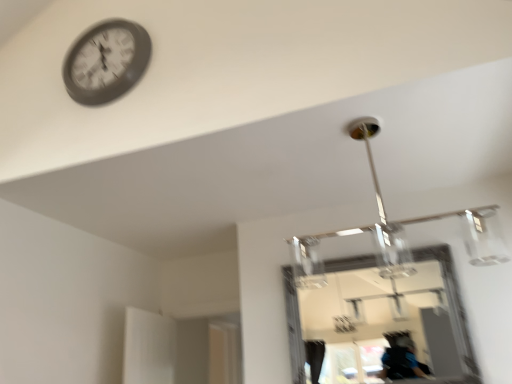
Question: From a real-world perspective, is matte black clock at upper left above or below clear glass mirror at center?

Choices:
 (A) below
 (B) above

Answer: (B)

Question: Considering the positions of point (128, 26) and point (433, 251), is point (128, 26) closer or farther from the camera than point (433, 251)?

Choices:
 (A) closer
 (B) farther

Answer: (A)

Question: Do you think matte black clock at upper left is within clear glass mirror at center, or outside of it?

Choices:
 (A) outside
 (B) inside

Answer: (A)

Question: Visually, is clear glass mirror at center positioned to the left or to the right of matte black clock at upper left?

Choices:
 (A) right
 (B) left

Answer: (A)

Question: Do you think clear glass mirror at center is within matte black clock at upper left, or outside of it?

Choices:
 (A) outside
 (B) inside

Answer: (A)

Question: Relative to matte black clock at upper left, is clear glass mirror at center in front or behind?

Choices:
 (A) front
 (B) behind

Answer: (B)

Question: From a real-world perspective, relative to matte black clock at upper left, is clear glass mirror at center vertically above or below?

Choices:
 (A) above
 (B) below

Answer: (B)